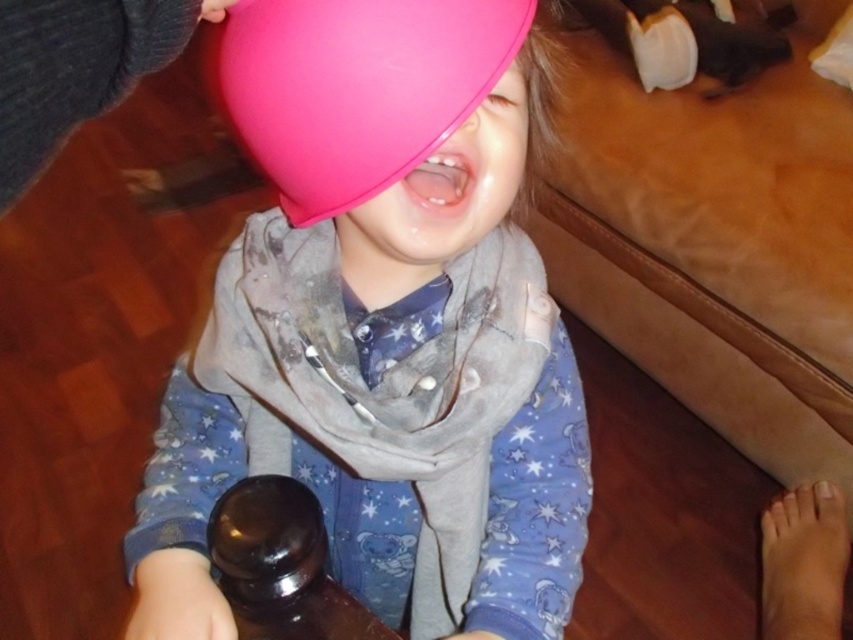
Question: Can you confirm if matte pink balloon at center is bigger than pink rubber balloon at upper center?

Choices:
 (A) yes
 (B) no

Answer: (A)

Question: Can you confirm if matte pink balloon at center is positioned below pink rubber balloon at upper center?

Choices:
 (A) no
 (B) yes

Answer: (B)

Question: Does matte pink balloon at center appear under pink rubber balloon at upper center?

Choices:
 (A) no
 (B) yes

Answer: (B)

Question: Which object is farther from the camera taking this photo?

Choices:
 (A) pink rubber balloon at upper center
 (B) matte pink balloon at center

Answer: (B)